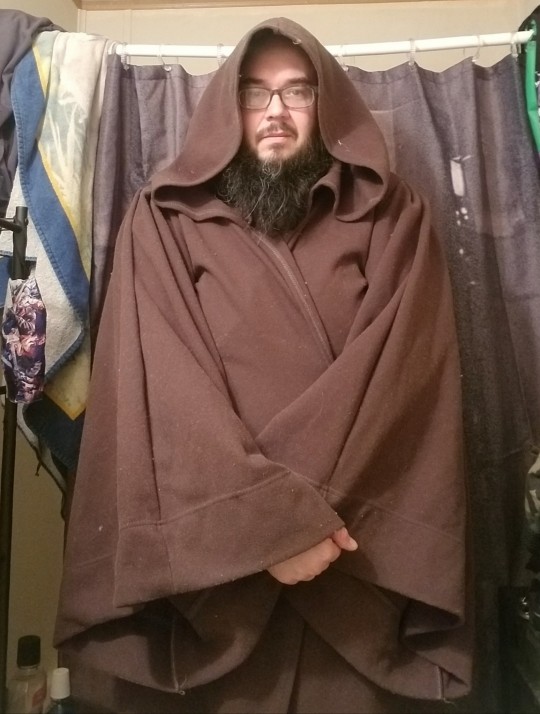
Locate an element on the screen. The image size is (540, 714). curtain rings is located at coordinates (411, 50), (512, 46), (472, 49), (339, 56), (218, 51), (162, 58), (122, 56).